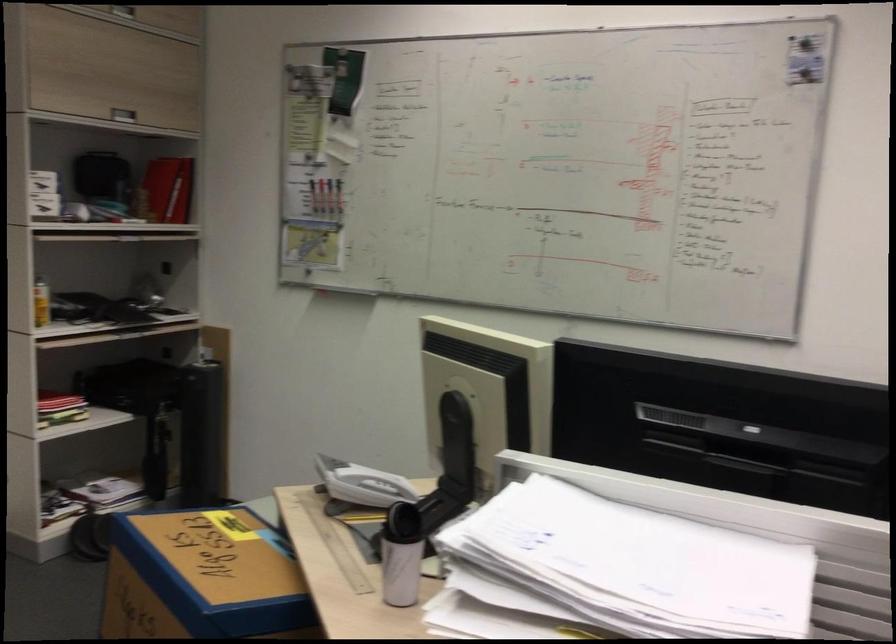
The location [724,426] corresponds to which object?

This point indicates the black storage case.